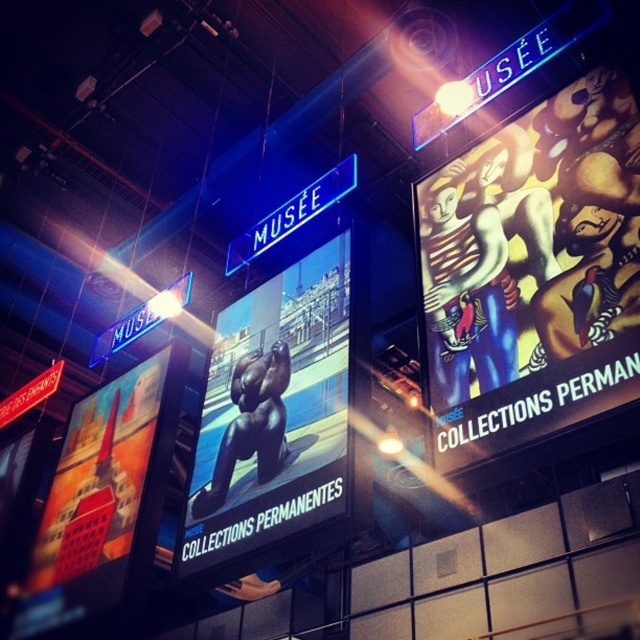
You are standing in the museum and want to take a photo of the point marked at coordinates (515, 412). Your camera has a maximum focus range of 7 meters. Will you be able to focus on that point from your current position?

The distance of point (515, 412) from viewer is 7.48 meters, which exceeds the camera maximum focus range of 7 meters. You need to move closer to focus on that point.

You are an art enthusiast visiting the museum and want to take a photo of the black glossy bear at center and the shiny black bear at left. Which bear should you focus on first if you want to capture both in a single frame without moving your camera? Explain your reasoning based on their positions.

The black glossy bear at center is wider than the shiny black bear at left, so focusing on the black glossy bear at center first would allow you to adjust the camera frame to include both, as it occupies more space in the scene.

You are standing in the museum and want to take a photo of the matte colorful painting at upper right. The museum requires that all photos must be taken from a specific angle to ensure the artwork is centered in the frame. Given that the painting is located at coordinates point 0.427, 0.834, can you determine if the painting will be centered in the frame if you position yourself directly in front of it?

The matte colorful painting at upper right is located at point (532, 273). Since the coordinates are specific, positioning yourself directly in front of it should center the painting in the frame.